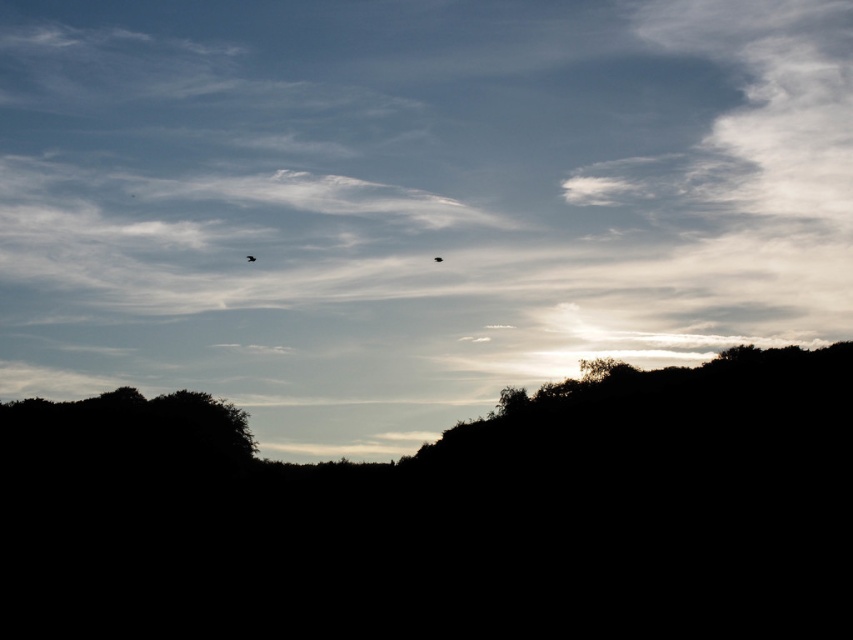
You are an astronomer observing the sky in the image. You notice a point labeled with coordinates. What object is located at point (x=412, y=198)?

The point (x=412, y=198) indicates a white fluffy cloud at upper center.

You are a birdwatcher observing the sky. You notice a white fluffy cloud at upper center and a matte black bird at upper center. Which object is wider?

The white fluffy cloud at upper center is wider than the matte black bird at upper center.